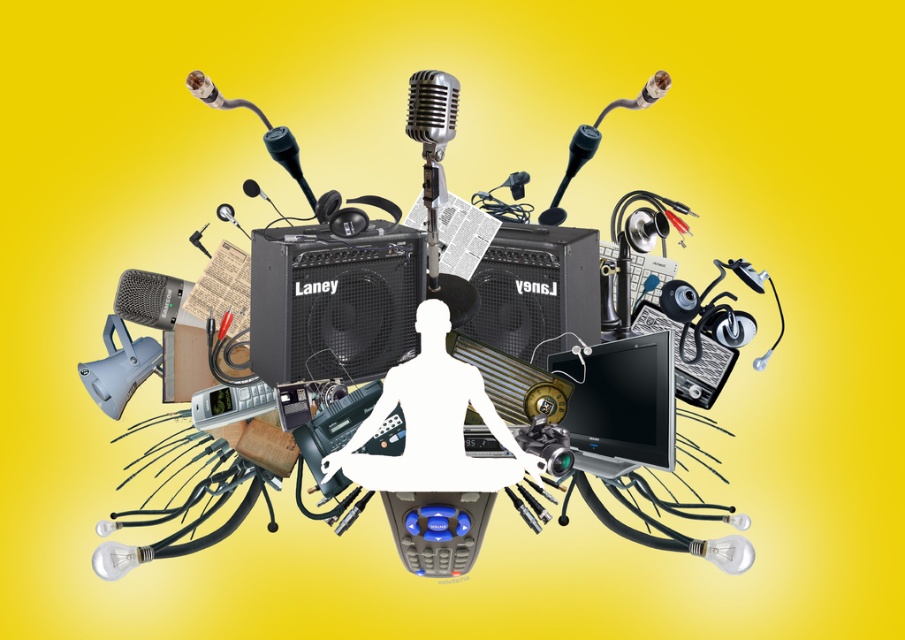
Question: Is shiny silver microphone at center wider than metallic black microphone at center?

Choices:
 (A) no
 (B) yes

Answer: (B)

Question: Is white matte person at center further to the viewer compared to black textured amplifier at center?

Choices:
 (A) yes
 (B) no

Answer: (B)

Question: Which of these objects is positioned farthest from the metallic black microphone at center?

Choices:
 (A) white matte person at center
 (B) black mesh speaker at center

Answer: (A)

Question: Which point is farther to the camera?

Choices:
 (A) (574, 168)
 (B) (583, 456)
 (C) (589, 156)

Answer: (A)

Question: Which of the following is the farthest from the observer?

Choices:
 (A) (440, 92)
 (B) (558, 198)
 (C) (315, 362)
 (D) (615, 449)

Answer: (B)

Question: Can you confirm if white matte person at center is wider than metallic black microphone at center?

Choices:
 (A) yes
 (B) no

Answer: (A)